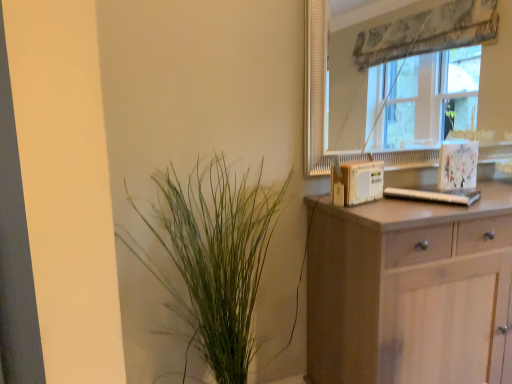
Question: From a real-world perspective, is light brown wooden chest of drawers at right physically located above or below transparent glass window at upper right?

Choices:
 (A) below
 (B) above

Answer: (A)

Question: Relative to transparent glass window at upper right, is light brown wooden chest of drawers at right in front or behind?

Choices:
 (A) front
 (B) behind

Answer: (A)

Question: Which object is the farthest from the green leafy plant at left?

Choices:
 (A) light brown wooden chest of drawers at right
 (B) transparent glass window at upper right

Answer: (B)

Question: Considering the real-world distances, which object is closest to the transparent glass window at upper right?

Choices:
 (A) green leafy plant at left
 (B) light brown wooden chest of drawers at right

Answer: (B)